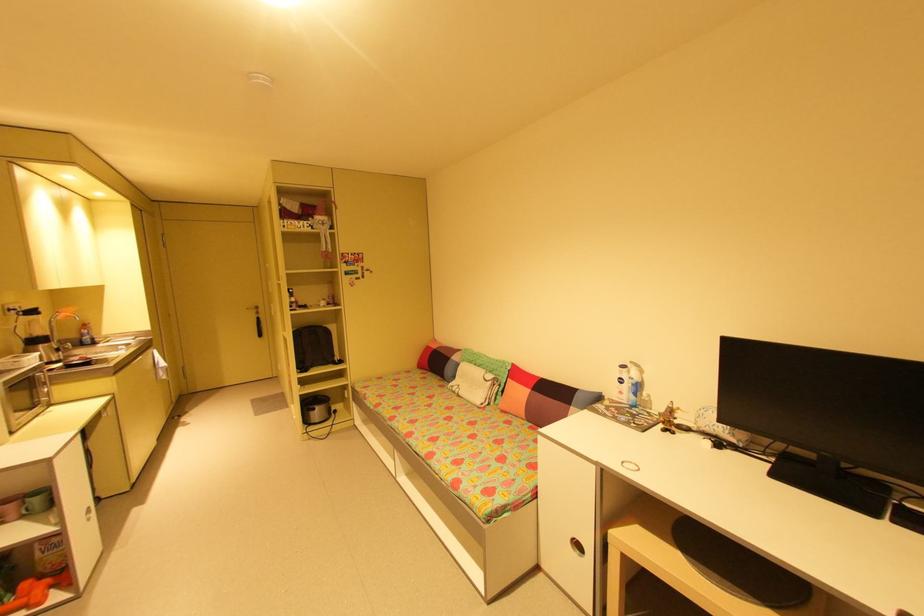
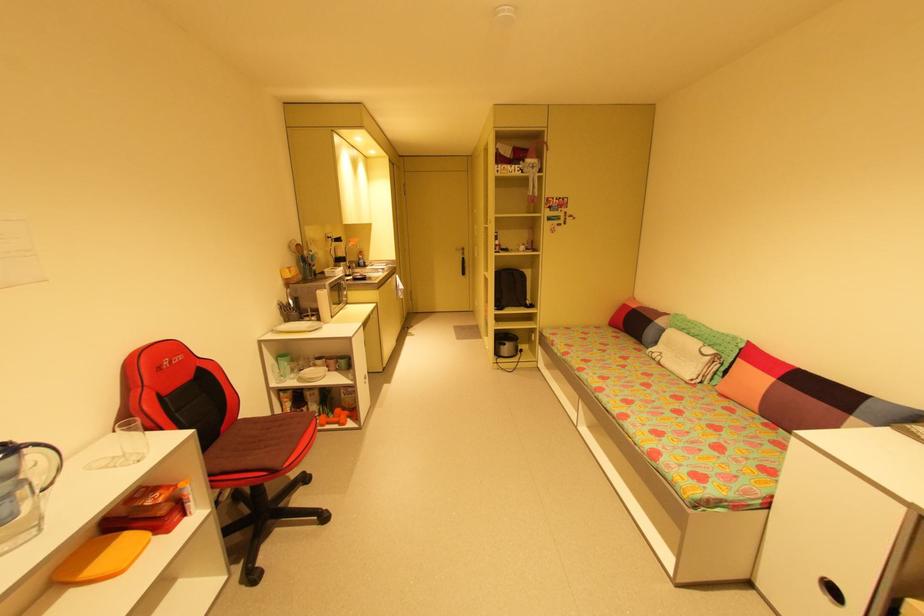
Locate, in the second image, the point that corresponds to the point at 251,309 in the first image.

(460, 249)